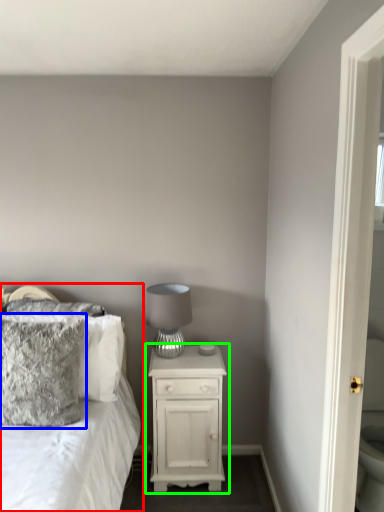
Question: Estimate the real-world distances between objects in this image. Which object is farther from bed (highlighted by a red box), pillow (highlighted by a blue box) or nightstand (highlighted by a green box)?

Choices:
 (A) pillow
 (B) nightstand

Answer: (B)